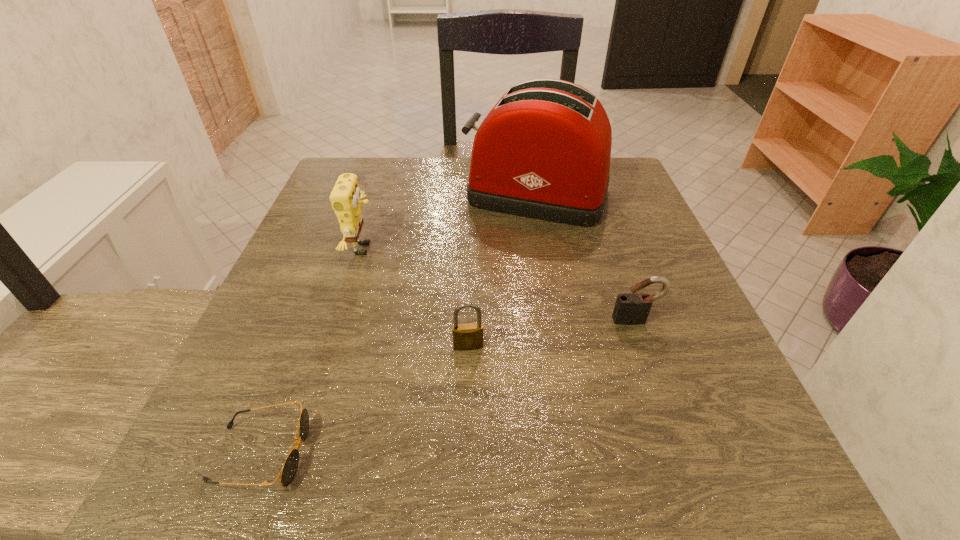
At what (x,y) coordinates should I click in order to perform the action: click on toaster. Please return your answer as a coordinate pair (x, y). The width and height of the screenshot is (960, 540). Looking at the image, I should click on (543, 152).

Find the location of a particular element. The image size is (960, 540). the fourth shortest object is located at coordinates (345, 197).

Identify the location of the third farthest object. (633, 307).

Where is `the right padlock`? the right padlock is located at coordinates (633, 307).

In order to click on the fourth farthest object in this screenshot , I will do `click(466, 337)`.

Identify the location of the nearer padlock. The image size is (960, 540). (466, 337).

In order to click on the nearest object in this screenshot , I will do `click(290, 466)`.

The height and width of the screenshot is (540, 960). Find the location of `the shortest object`. the shortest object is located at coordinates (290, 466).

At what (x,y) coordinates should I click in order to perform the action: click on free space located 0.340m on the left of the toaster. Please return your answer as a coordinate pair (x, y). This screenshot has width=960, height=540. Looking at the image, I should click on (321, 194).

The image size is (960, 540). What are the coordinates of `vacant space positioned on the face of the second tallest object` in the screenshot? It's located at (407, 249).